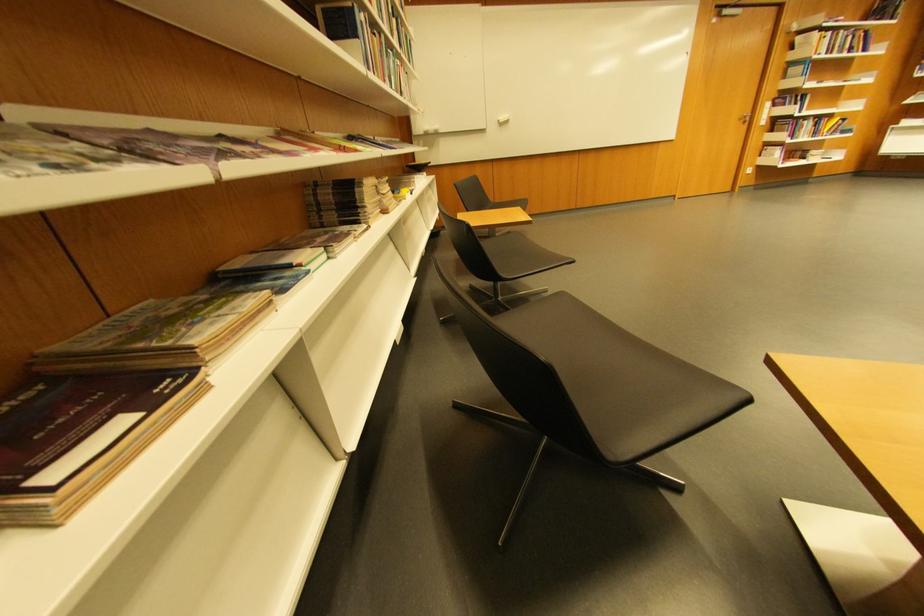
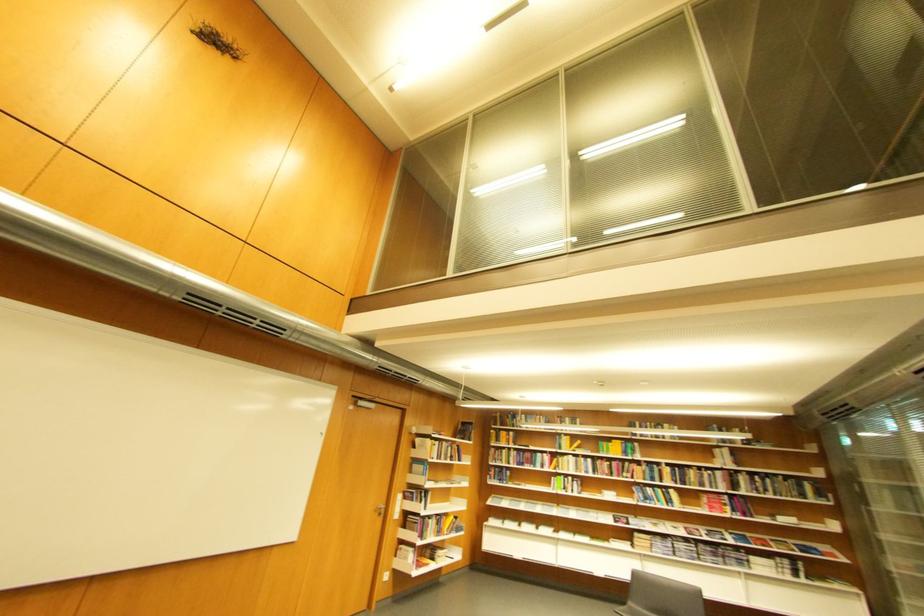
The point at (861, 172) is marked in the first image. Where is the corresponding point in the second image?

(479, 565)